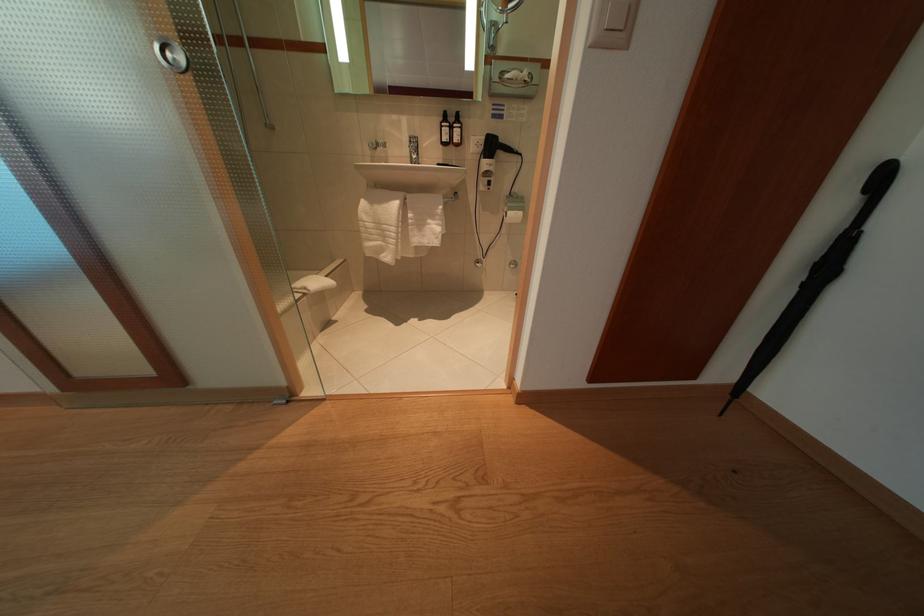
You are a GUI agent. You are given a task and a screenshot of the screen. Output one action in this format:
    pyautogui.click(x=<x>, y=<y>)
    Task: Click on the silver faucet handle
    The image size is (924, 616).
    Given the screenshot: What is the action you would take?
    pyautogui.click(x=412, y=148)